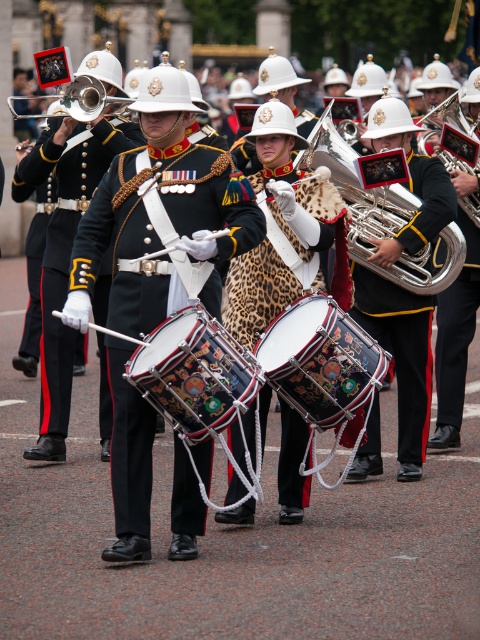
Where is the shiny black uniform at center located in the image?

The shiny black uniform at center is located at point 0.388 on the x axis and 0.140 on the y axis.

You are a photographer positioned at the front of the parade. You want to take a photo of the shiny black uniform at center and the polished silver trumpet at center. Which object will appear closer to you in the photo?

The shiny black uniform at center will appear closer to you in the photo because the polished silver trumpet at center is behind it.